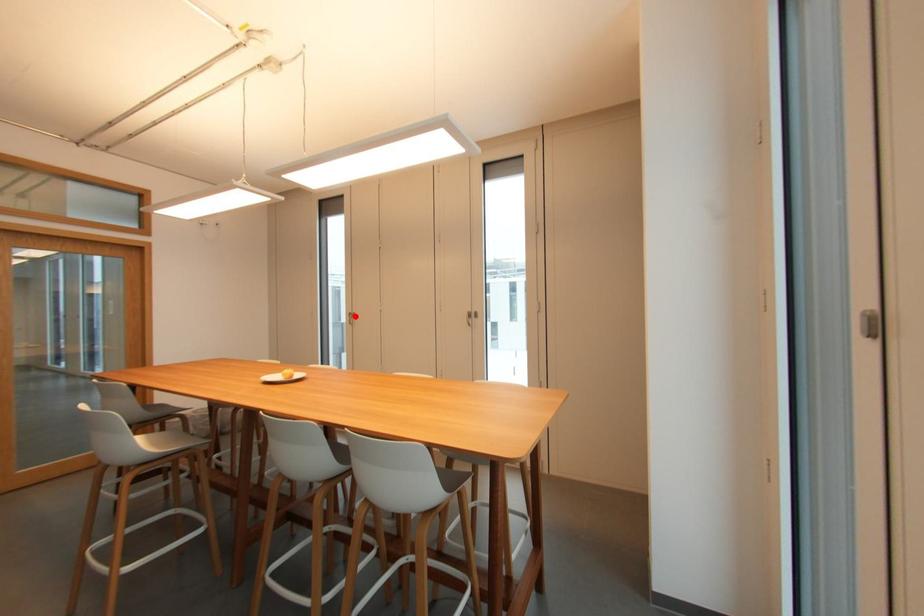
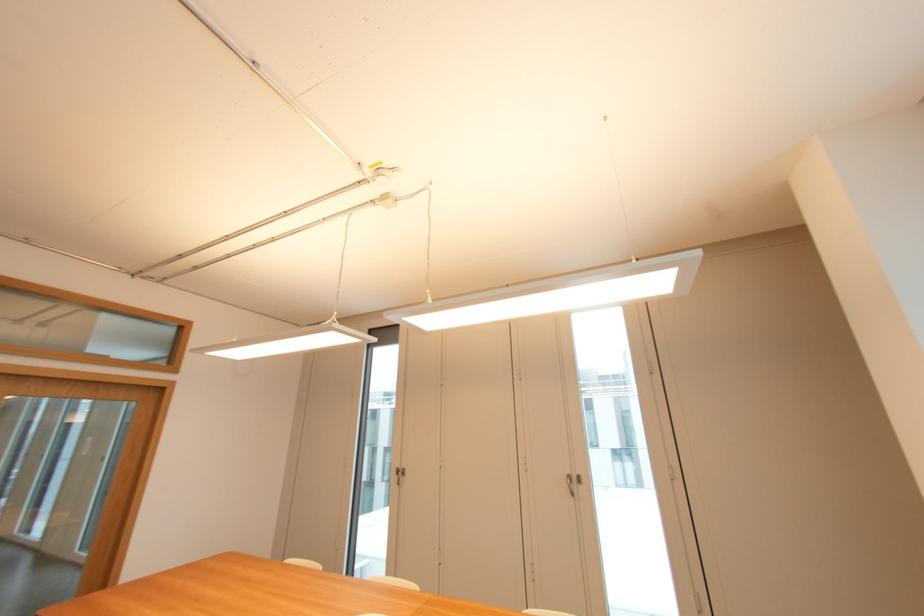
Question: I am providing you with two images of the same scene from different viewpoints. A red point is marked on the first image. Can you still see the location of the red point in image 2?

Choices:
 (A) Yes
 (B) No

Answer: (A)